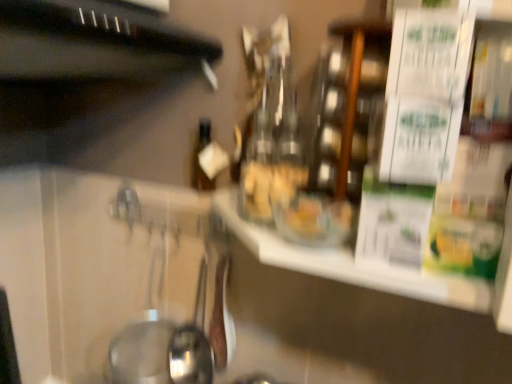
You are a GUI agent. You are given a task and a screenshot of the screen. Output one action in this format:
    pyautogui.click(x=<x>, y=<y>)
    Task: Click on the shiny silver spoon at center
    The image size is (512, 384).
    Given the screenshot: What is the action you would take?
    pyautogui.click(x=192, y=342)

What do you see at coordinates (192, 342) in the screenshot? I see `shiny silver spoon at center` at bounding box center [192, 342].

You are a GUI agent. You are given a task and a screenshot of the screen. Output one action in this format:
    pyautogui.click(x=<x>, y=<y>)
    Task: Click on the shiny silver spoon at center
    
    Given the screenshot: What is the action you would take?
    pyautogui.click(x=192, y=342)